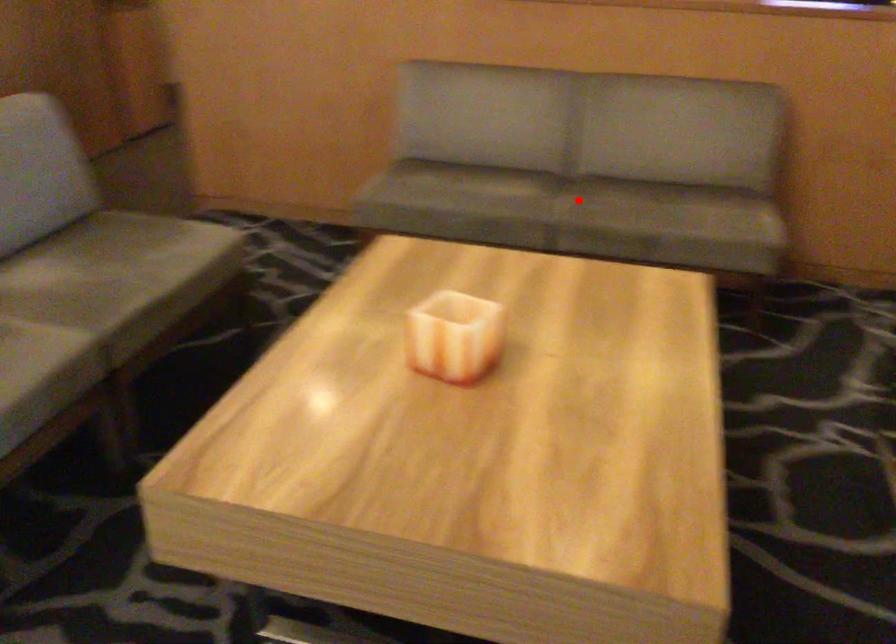
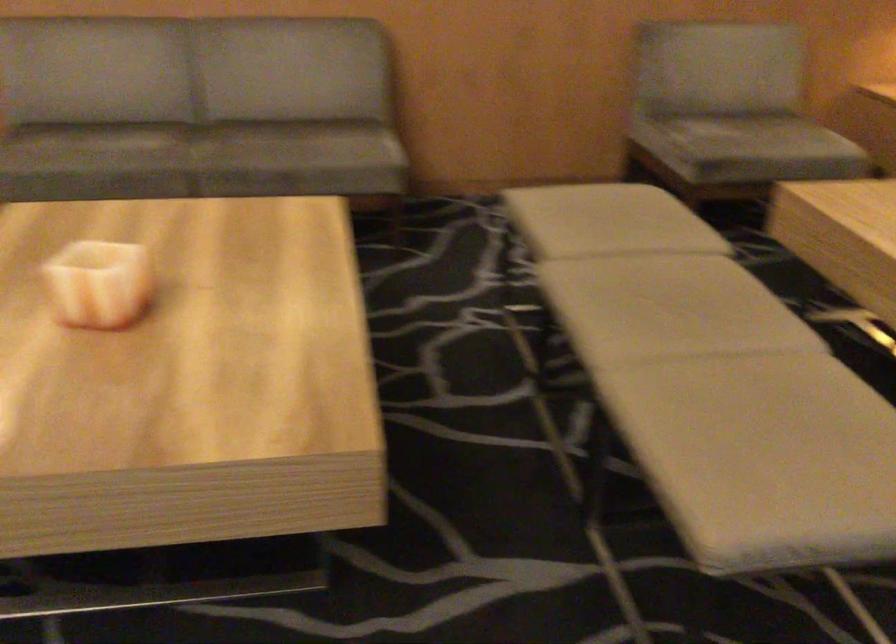
Find the pixel in the second image that matches the highlighted location in the first image.

(209, 144)